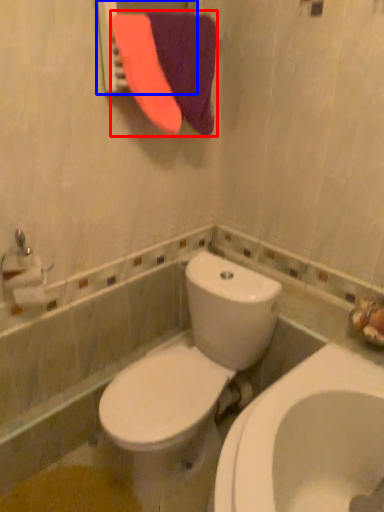
Question: Which of the following is the farthest to the observer, beach towel (highlighted by a red box) or mirror (highlighted by a blue box)?

Choices:
 (A) beach towel
 (B) mirror

Answer: (A)